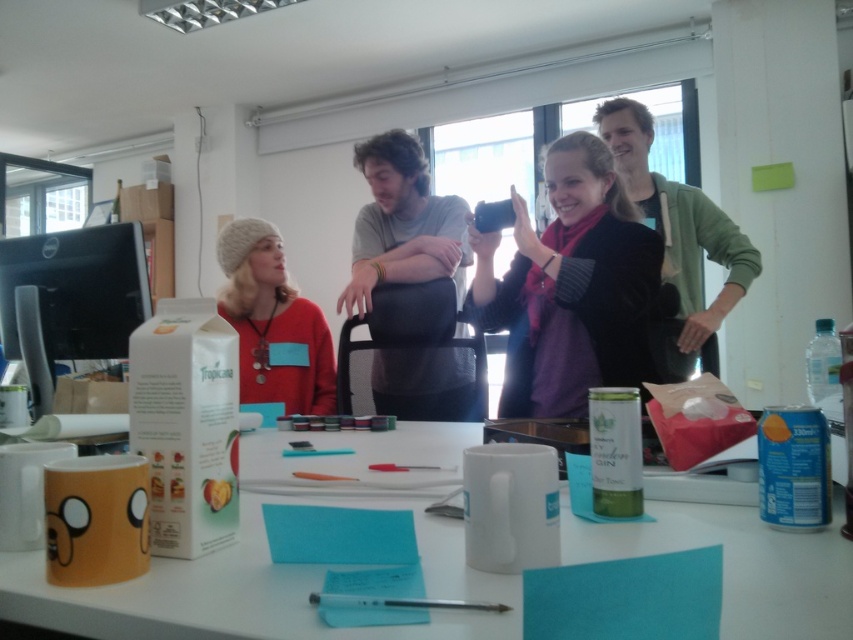
You are organizing a virtual meeting and need to position the black glossy monitor at left so that participants can see the white matte table at center clearly. Based on their current positions, is the monitor placed in a suitable location to capture the table in the frame?

The white matte table at center is located below the black glossy monitor at left, so the monitor is placed above the table. This positioning might make it difficult for participants to see the table clearly during the virtual meeting.

You are a photographer standing at the camera position. You want to capture a closeup shot of the white matte table at center. Is the table within your camera lens range if the minimum focusing distance is 18 inches?

The white matte table at center is 20.31 inches away from the camera, which is beyond the minimum focusing distance of 18 inches. Therefore, the table is within the camera lens range and can be focused on properly.